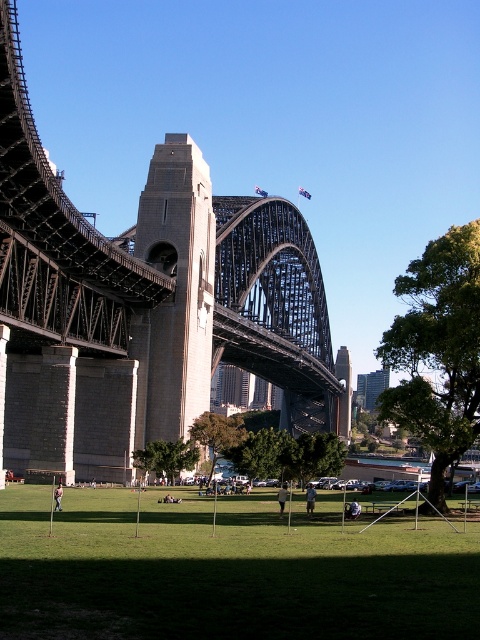
Does green grass at center have a smaller size compared to white cotton shirt at center?

No.

Is green grass at center thinner than white cotton shirt at center?

Incorrect, green grass at center's width is not less than white cotton shirt at center's.

Based on the photo, who is more forward, (48, 540) or (308, 488)?

Point (48, 540) is in front.

In order to click on green grass at center in this screenshot , I will do `click(227, 572)`.

Is point (402, 588) positioned before point (347, 515)?

Yes, point (402, 588) is closer to viewer.

Is green grass at center below dark blue jeans at center?

Incorrect, green grass at center is not positioned below dark blue jeans at center.

This screenshot has width=480, height=640. What are the coordinates of `green grass at center` in the screenshot? It's located at (227, 572).

Between white cotton shirt at center and dark blue jeans at center, which one appears on the right side from the viewer's perspective?

From the viewer's perspective, dark blue jeans at center appears more on the right side.

Measure the distance between white cotton shirt at center and camera.

They are 58.01 meters apart.

Is point (314, 496) behind point (350, 502)?

No, it is in front of (350, 502).

Find the location of a particular element. Image resolution: width=480 pixels, height=640 pixels. white cotton shirt at center is located at coordinates (310, 499).